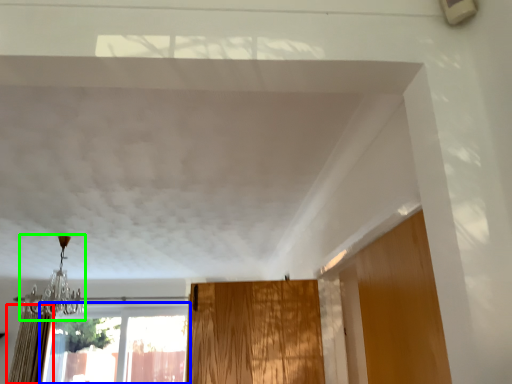
Question: Based on their relative distances, which object is farther from curtain (highlighted by a red box)? Choose from window (highlighted by a blue box) and light fixture (highlighted by a green box).

Choices:
 (A) window
 (B) light fixture

Answer: (A)